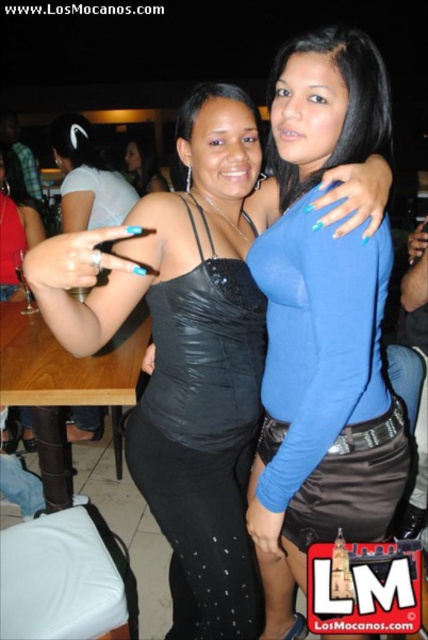
You are a photographer at a party and need to adjust the lighting so both the black satin dress at center and the matte black top at upper left are equally visible. Since one is much taller than the other, which one might need more light adjustment to ensure visibility?

The matte black top at upper left might need more light adjustment because it is shorter than the black satin dress at center, so it might be in a shadowed area or require closer focus to be as visible.

Looking at this image, you are at a party and want to take a photo of the two women. The photographer tells you that the woman at point (x=276, y=291) and the woman at point (x=211, y=380) are in the frame. Which woman is closer to the camera?

The woman at point (x=276, y=291) is closer to the camera because point (x=276, y=291) is in front of point (x=211, y=380).

You are a photographer at a party and want to ensure both the blue satin top at center and the matte black dress at center are visible in the frame. Given their height difference, which one might you need to adjust your camera angle to focus on?

The blue satin top at center is taller than the matte black dress at center, so you might need to adjust your camera angle to focus on the taller blue satin top at center to ensure both are visible.